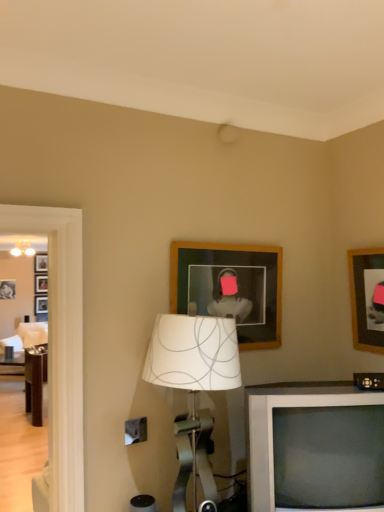
Question: Does wooden picture frame at upper center, positioned as the 2th picture frame in right-to-left order, have a lesser width compared to wooden picture frame at upper right, arranged as the second picture frame when viewed from the left?

Choices:
 (A) no
 (B) yes

Answer: (B)

Question: Considering the relative sizes of wooden picture frame at upper center, acting as the 1th picture frame starting from the left, and wooden picture frame at upper right, arranged as the second picture frame when viewed from the left, in the image provided, is wooden picture frame at upper center, acting as the 1th picture frame starting from the left, wider than wooden picture frame at upper right, arranged as the second picture frame when viewed from the left,?

Choices:
 (A) yes
 (B) no

Answer: (B)

Question: From the image's perspective, is wooden picture frame at upper center, positioned as the 2th picture frame in right-to-left order, on top of wooden picture frame at upper right, arranged as the first picture frame when viewed from the right?

Choices:
 (A) no
 (B) yes

Answer: (B)

Question: Is wooden picture frame at upper center, positioned as the 2th picture frame in right-to-left order, oriented towards wooden picture frame at upper right, arranged as the first picture frame when viewed from the right?

Choices:
 (A) yes
 (B) no

Answer: (B)

Question: Is wooden picture frame at upper right, arranged as the first picture frame when viewed from the right, a part of wooden picture frame at upper center, acting as the 1th picture frame starting from the left?

Choices:
 (A) yes
 (B) no

Answer: (B)

Question: Considering their positions, is white fabric lampshade at center located in front of or behind white plastic television at lower right?

Choices:
 (A) behind
 (B) front

Answer: (B)

Question: Looking at their shapes, would you say white fabric lampshade at center is wider or thinner than white plastic television at lower right?

Choices:
 (A) wide
 (B) thin

Answer: (A)

Question: Based on their positions, is white fabric lampshade at center located to the left or right of white plastic television at lower right?

Choices:
 (A) right
 (B) left

Answer: (B)

Question: Looking at the image, does white fabric lampshade at center seem bigger or smaller compared to white plastic television at lower right?

Choices:
 (A) big
 (B) small

Answer: (A)

Question: Is point (163, 378) closer or farther from the camera than point (365, 266)?

Choices:
 (A) farther
 (B) closer

Answer: (B)

Question: From the image's perspective, is white fabric lampshade at center located above or below wooden picture frame at upper right, arranged as the first picture frame when viewed from the right?

Choices:
 (A) below
 (B) above

Answer: (A)

Question: Is white fabric lampshade at center taller or shorter than wooden picture frame at upper right, arranged as the second picture frame when viewed from the left?

Choices:
 (A) tall
 (B) short

Answer: (A)

Question: Is white fabric lampshade at center wider or thinner than wooden picture frame at upper right, arranged as the first picture frame when viewed from the right?

Choices:
 (A) wide
 (B) thin

Answer: (A)

Question: Considering the positions of point (357, 338) and point (226, 323), is point (357, 338) closer or farther from the camera than point (226, 323)?

Choices:
 (A) farther
 (B) closer

Answer: (A)

Question: Is wooden picture frame at upper right, arranged as the second picture frame when viewed from the left, inside or outside of white fabric lampshade at center?

Choices:
 (A) outside
 (B) inside

Answer: (A)